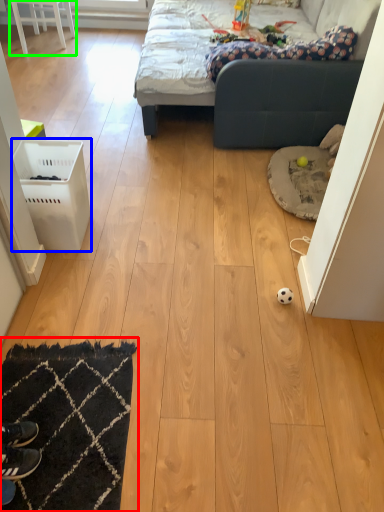
Question: Considering the real-world distances, which object is farthest from mat (highlighted by a red box)? laundry basket (highlighted by a blue box) or furniture (highlighted by a green box)?

Choices:
 (A) laundry basket
 (B) furniture

Answer: (B)